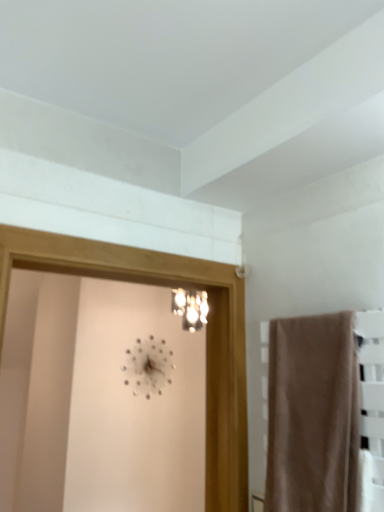
Question: Is clear glass screen door at center outside beige fabric towel at right?

Choices:
 (A) yes
 (B) no

Answer: (A)

Question: Is the depth of clear glass screen door at center greater than that of beige fabric towel at right?

Choices:
 (A) yes
 (B) no

Answer: (A)

Question: Can you confirm if clear glass screen door at center is shorter than beige fabric towel at right?

Choices:
 (A) yes
 (B) no

Answer: (B)

Question: Is clear glass screen door at center positioned far away from beige fabric towel at right?

Choices:
 (A) no
 (B) yes

Answer: (A)

Question: Can you confirm if clear glass screen door at center is thinner than beige fabric towel at right?

Choices:
 (A) yes
 (B) no

Answer: (B)

Question: Would you say beige fabric towel at right is part of clear glass screen door at center's contents?

Choices:
 (A) no
 (B) yes

Answer: (A)

Question: Considering the relative positions of beige fabric towel at right and metallic silver clock at upper center in the image provided, is beige fabric towel at right to the left of metallic silver clock at upper center from the viewer's perspective?

Choices:
 (A) no
 (B) yes

Answer: (A)

Question: Is beige fabric towel at right looking in the opposite direction of metallic silver clock at upper center?

Choices:
 (A) yes
 (B) no

Answer: (B)

Question: Can metallic silver clock at upper center be found inside beige fabric towel at right?

Choices:
 (A) no
 (B) yes

Answer: (A)

Question: Does beige fabric towel at right appear on the right side of metallic silver clock at upper center?

Choices:
 (A) yes
 (B) no

Answer: (A)

Question: From a real-world perspective, is beige fabric towel at right under metallic silver clock at upper center?

Choices:
 (A) no
 (B) yes

Answer: (B)

Question: Can you confirm if beige fabric towel at right is wider than metallic silver clock at upper center?

Choices:
 (A) no
 (B) yes

Answer: (B)

Question: Is the depth of clear glass screen door at center greater than that of metallic silver clock at upper center?

Choices:
 (A) yes
 (B) no

Answer: (B)